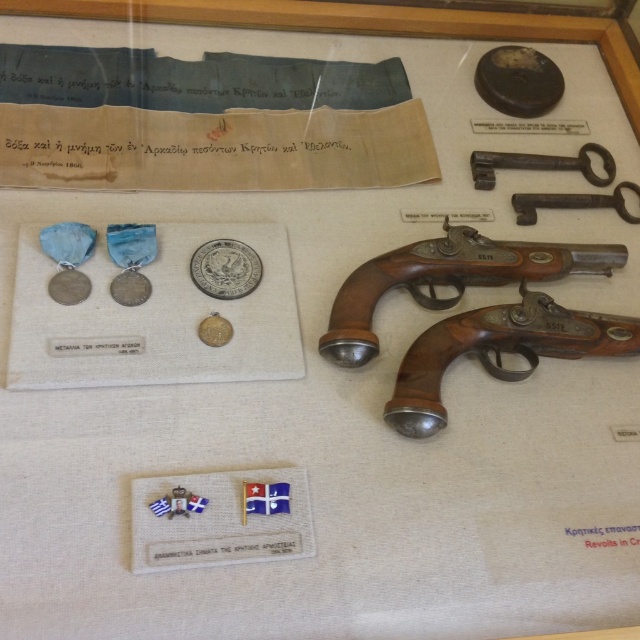
Question: Is dark brown wood key at upper right positioned before silver metallic coin at center-left?

Choices:
 (A) no
 (B) yes

Answer: (A)

Question: Which object appears closest to the camera in this image?

Choices:
 (A) silver metallic coin at center-left
 (B) dark brown wood key at upper right
 (C) silver/brass coin at center
 (D) gold plated coin at center

Answer: (D)

Question: Can you confirm if brown wooden pistol at center is positioned below silver metallic coin at center-left?

Choices:
 (A) no
 (B) yes

Answer: (A)

Question: Which object is the farthest from the wooden smooth pistol at center?

Choices:
 (A) brown wooden pistol at center
 (B) gold plated coin at center
 (C) silver metallic coin at center-left
 (D) silver metallic coin at upper left

Answer: (D)

Question: Does wooden smooth pistol at center lie behind silver/brass coin at center?

Choices:
 (A) no
 (B) yes

Answer: (A)

Question: Considering the real-world distances, which object is closest to the silver/brass coin at center?

Choices:
 (A) silver metallic coin at center-left
 (B) wooden smooth pistol at center
 (C) brown wooden pistol at center
 (D) dark brown wood key at upper right

Answer: (A)